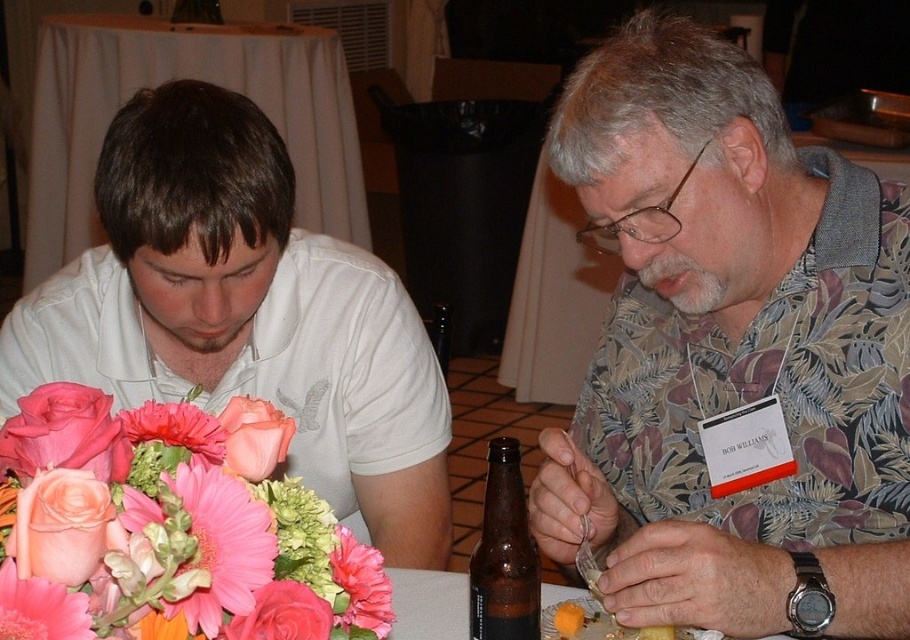
You are a photographer trying to capture a candid shot of the two people at the wooden table at center without the pink matte flower at center blocking the view. Can you position yourself so that the flower is not in the frame?

The pink matte flower at center is behind the wooden table at center, so positioning yourself behind the table would allow you to take the photo without the flower obstructing the view.

From the picture: You are standing in front of the table and want to place a small vase exactly where the matte white shirt at center is located. Is this possible?

The matte white shirt at center is located at coordinates (245, 314), so yes, you can place the vase there as it specifies an exact 2D point.